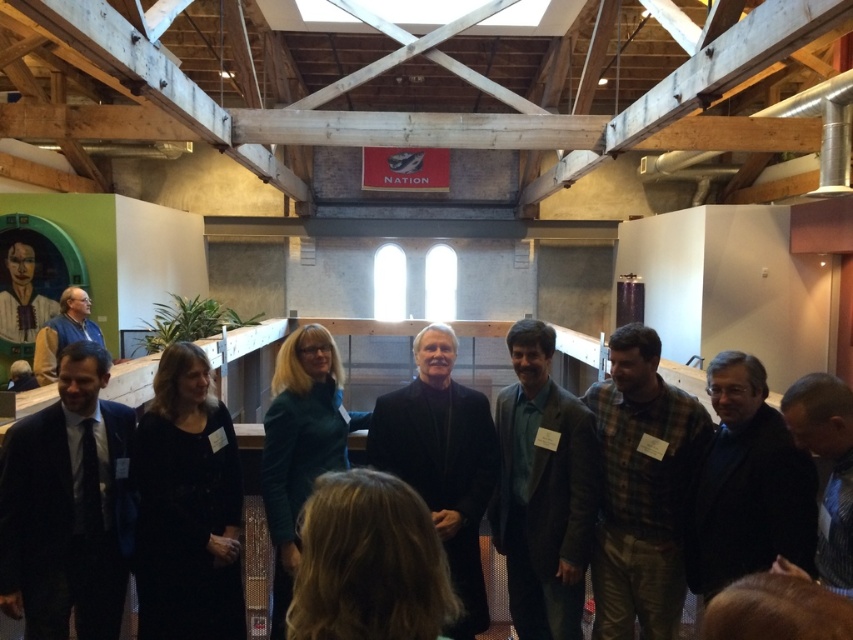
Question: Which point is farther from the camera taking this photo?

Choices:
 (A) (90, 470)
 (B) (322, 326)
 (C) (463, 387)
 (D) (782, 413)

Answer: (C)

Question: Which point is farther to the camera?

Choices:
 (A) satin black suit at left
 (B) plaid fabric shirt at center
 (C) black matte dress at center
 (D) matte black suit at left

Answer: (D)

Question: Can you confirm if green matte suit at center is smaller than black matte suit at center?

Choices:
 (A) no
 (B) yes

Answer: (B)

Question: Is satin black suit at left above plaid fabric shirt at center?

Choices:
 (A) yes
 (B) no

Answer: (B)

Question: Considering the real-world distances, which object is farthest from the satin black suit at left?

Choices:
 (A) plaid fabric shirt at center
 (B) matte black suit at left

Answer: (B)

Question: Is green matte suit at center thinner than black matte suit at center?

Choices:
 (A) no
 (B) yes

Answer: (B)